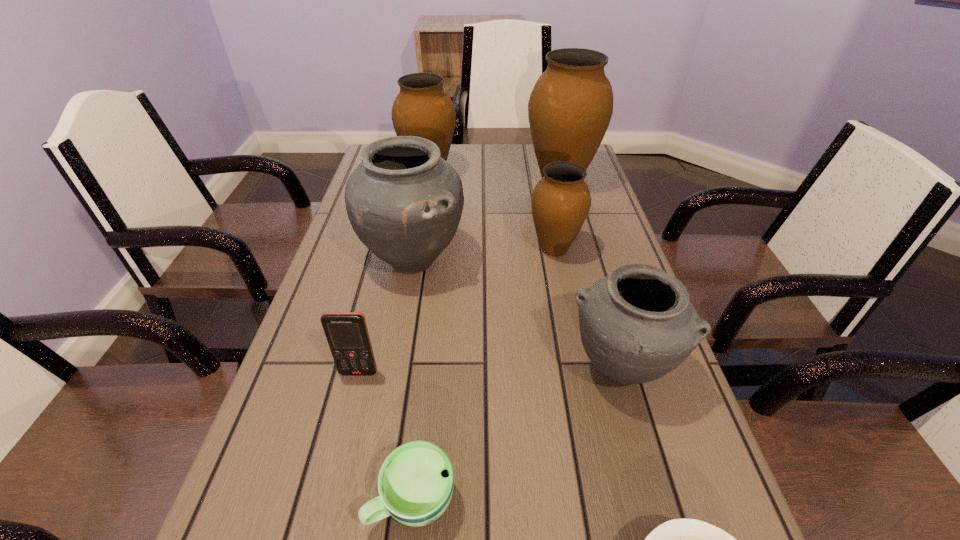
Image resolution: width=960 pixels, height=540 pixels. I want to click on free spot that satisfies the following two spatial constraints: 1. on the front side of the blue cup; 2. on the left side of the leftmost brown urn, so click(x=372, y=499).

Find the location of a particular element. Image resolution: width=960 pixels, height=540 pixels. vacant point that satisfies the following two spatial constraints: 1. on the screen of the blue cup; 2. on the right side of the third shortest object is located at coordinates (327, 499).